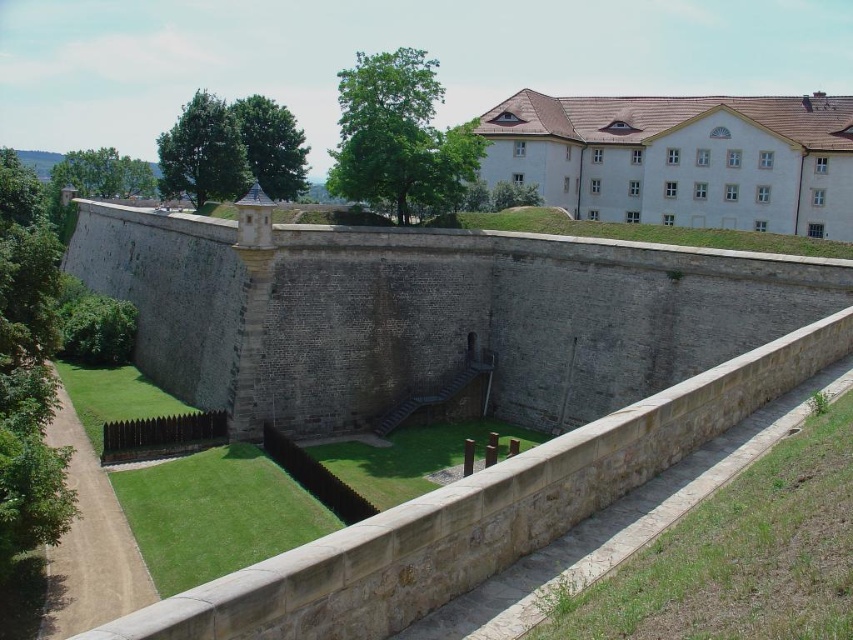
Looking at this image, you are a tourist standing at the entrance of the fortification wall. You see the brown stone moat at lower left and the white stone building at upper right. Which structure is taller?

The white stone building at upper right is taller than the brown stone moat at lower left.

You are standing on the pathway next to the gray stone wall at center. If you walk straight ahead, will you eventually reach the point marked by point (430,314)?

The gray stone wall at center is represented by point (430,314), so yes, walking straight ahead along the pathway next to the gray stone wall at center will lead you to that point.